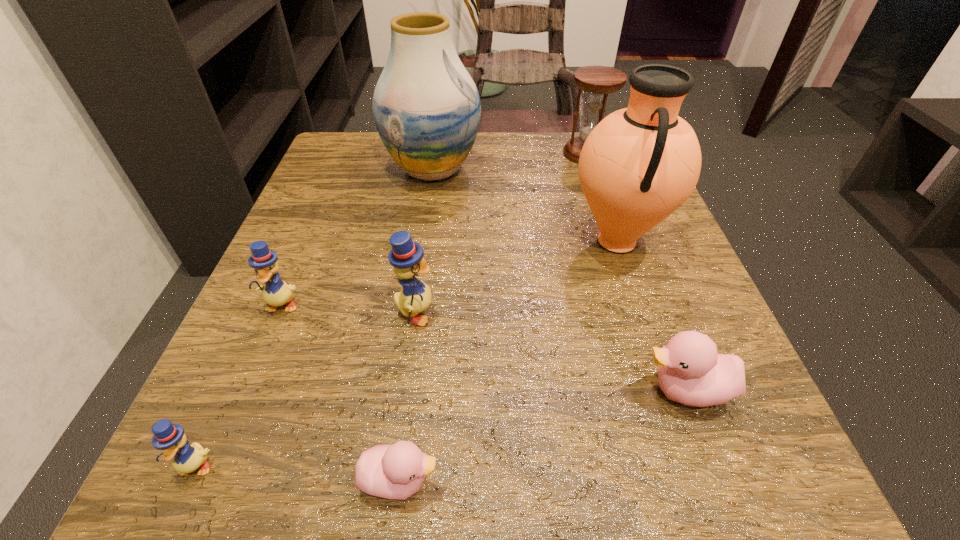
The image size is (960, 540). What are the coordinates of `the shortest duckling` in the screenshot? It's located at (396, 471).

This screenshot has width=960, height=540. I want to click on vacant space situated on the front of the vase, so click(x=425, y=219).

This screenshot has width=960, height=540. What are the coordinates of `vacant space located on the left of the pitcher` in the screenshot? It's located at (477, 241).

Where is `vacant region located on the front of the hourglass`? The width and height of the screenshot is (960, 540). vacant region located on the front of the hourglass is located at coordinates (596, 184).

Locate an element on the screen. blank area located on the face of the biggest yellow duckling, where the monocle is placed is located at coordinates (626, 314).

At what (x,y) coordinates should I click in order to perform the action: click on free space located 0.240m on the face of the second biggest yellow duckling, where the monocle is placed. Please return your answer as a coordinate pair (x, y). Looking at the image, I should click on (207, 481).

I want to click on blank area located on the front-facing side of the right pink duckling, so click(532, 390).

The height and width of the screenshot is (540, 960). Identify the location of free space located on the front-facing side of the right pink duckling. (417, 390).

You are a GUI agent. You are given a task and a screenshot of the screen. Output one action in this format:
    pyautogui.click(x=<x>, y=<y>)
    Task: Click on the vacant space located 0.330m on the front-facing side of the right pink duckling
    This screenshot has height=540, width=960.
    Given the screenshot: What is the action you would take?
    pyautogui.click(x=386, y=390)

Image resolution: width=960 pixels, height=540 pixels. In order to click on vacant space located on the front-facing side of the shortest duckling in this screenshot , I will do `click(528, 480)`.